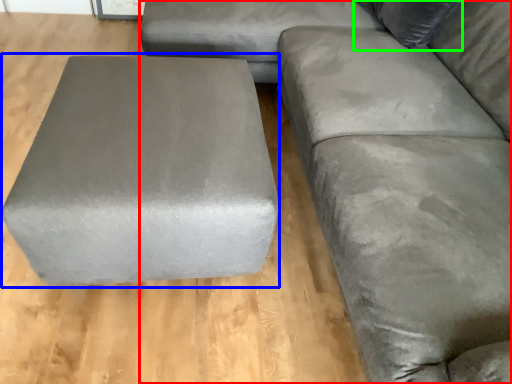
Question: Based on their relative distances, which object is nearer to studio couch (highlighted by a red box)? Choose from stool (highlighted by a blue box) and pillow (highlighted by a green box).

Choices:
 (A) stool
 (B) pillow

Answer: (B)